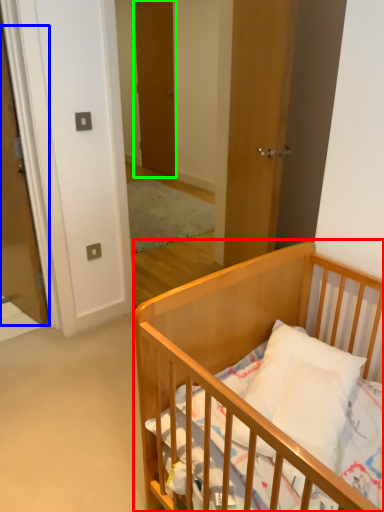
Question: Which object is positioned farthest from infant bed (highlighted by a red box)? Select from door (highlighted by a blue box) and door (highlighted by a green box).

Choices:
 (A) door
 (B) door

Answer: (B)